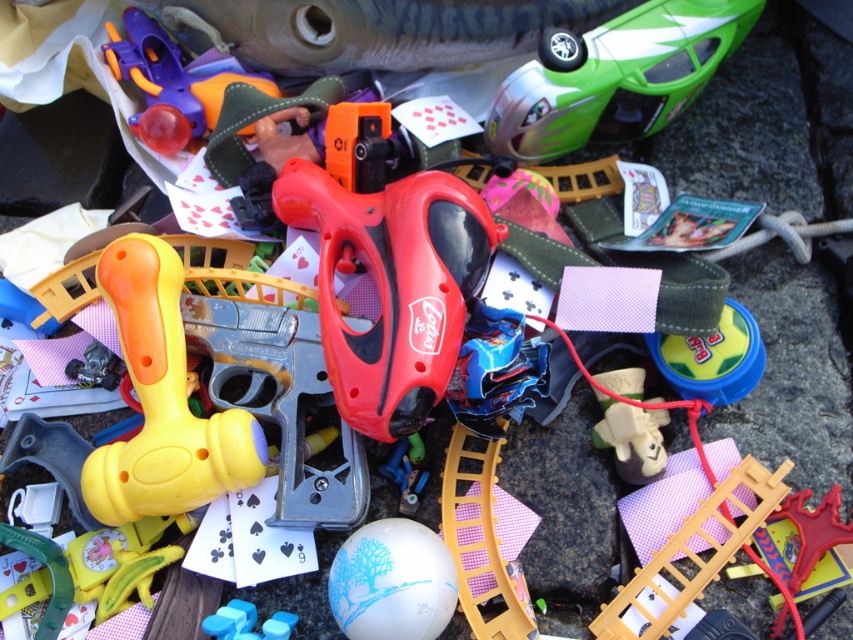
Looking at this image, you are standing at the point labeled as point (143, 269) in the image. You want to pick up a toy that is exactly 3.53 feet away from you. Which toy can you reach without moving from your current position?

The point labeled as point (143, 269) is 3.53 feet away from the viewer, so the toy that is exactly 3.53 feet away from you would be the one located at that point. However, the description does not specify which toy is at that point. Therefore, it is impossible to determine which toy you can reach without additional information.